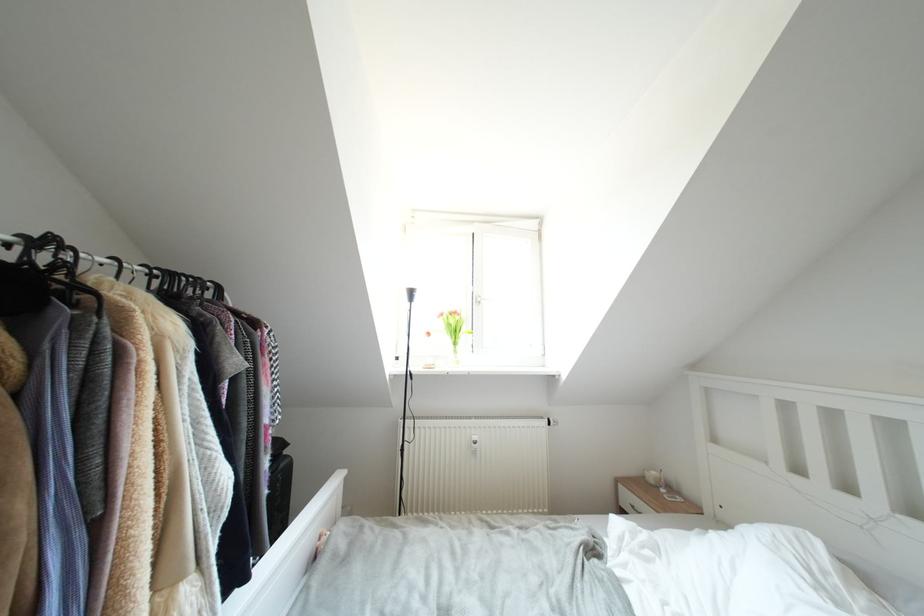
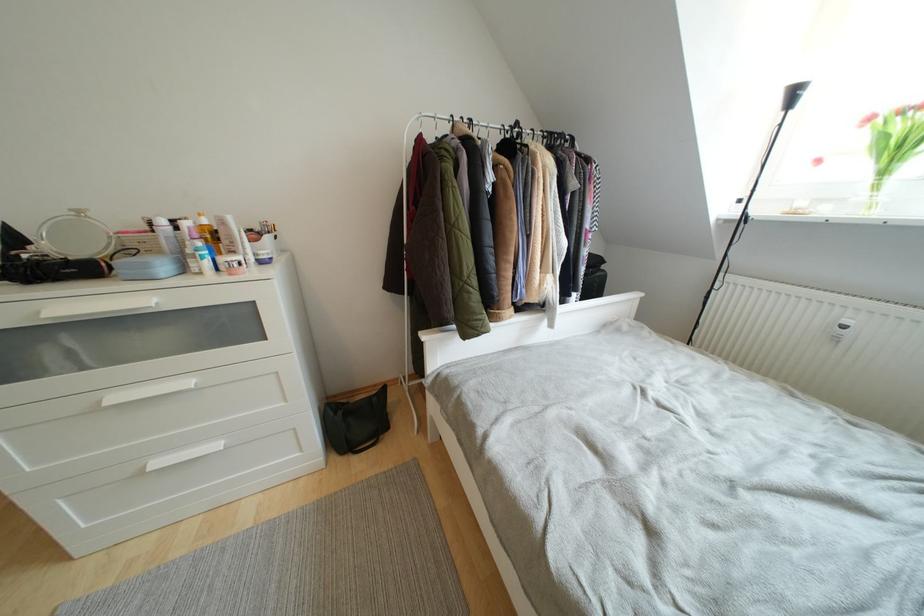
The point at [459,347] is marked in the first image. Where is the corresponding point in the second image?

(890, 176)